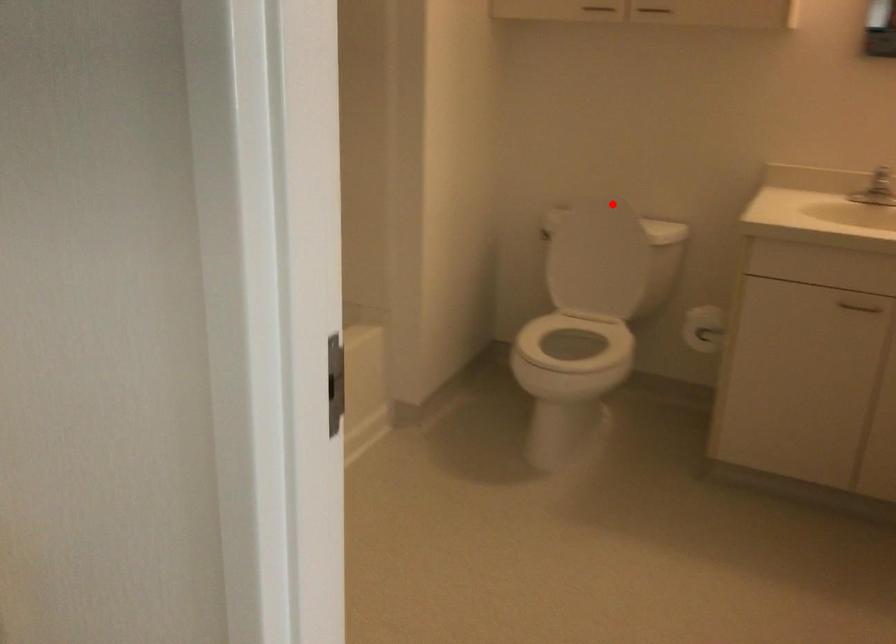
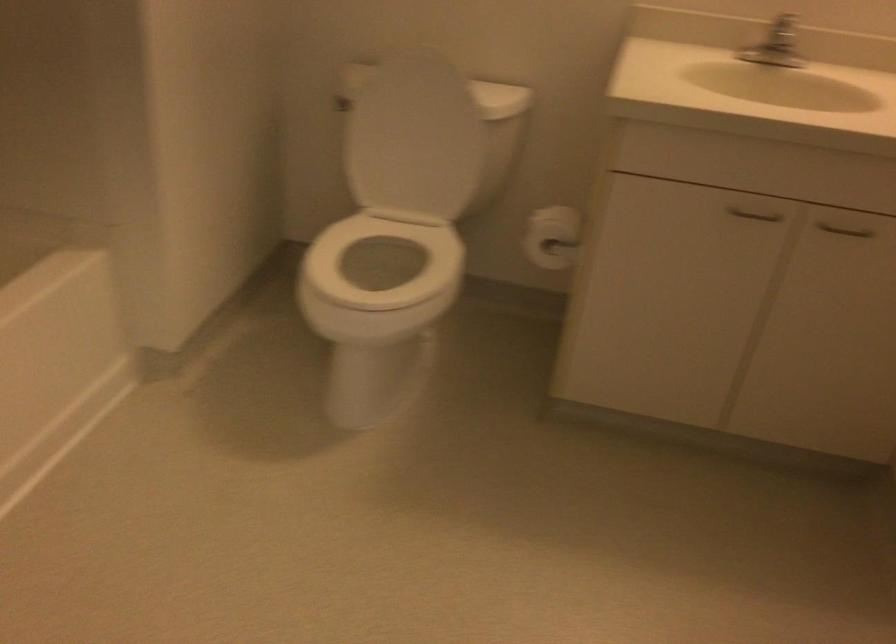
Question: I am providing you with two images of the same scene from different viewpoints. A red point is marked on the first image. Can you still see the location of the red point in image 2?

Choices:
 (A) Yes
 (B) No

Answer: (A)